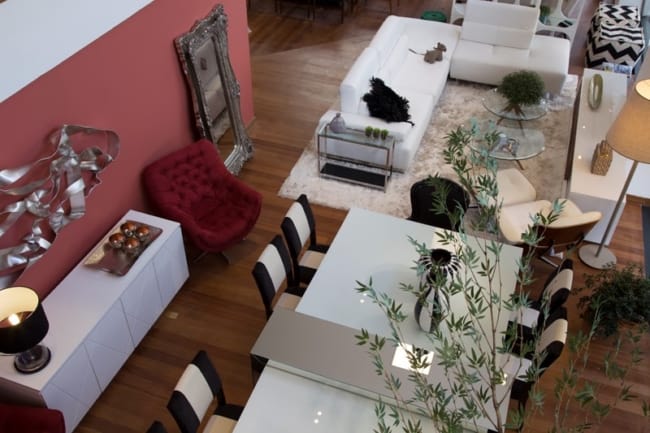
Where is `mirror`? This screenshot has width=650, height=433. mirror is located at coordinates (214, 89).